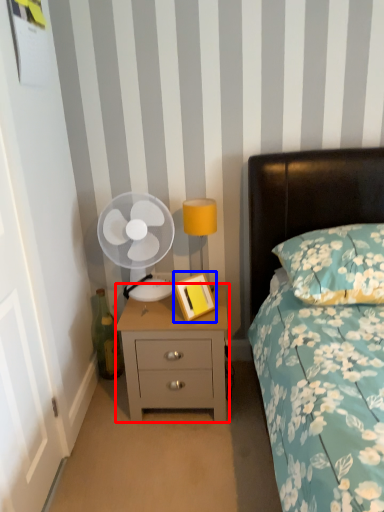
Question: Which of the following is the farthest to the observer, nightstand (highlighted by a red box) or picture frame (highlighted by a blue box)?

Choices:
 (A) nightstand
 (B) picture frame

Answer: (A)